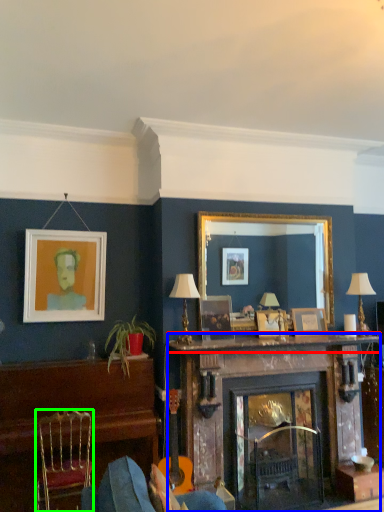
Question: Estimate the real-world distances between objects in this image. Which object is farther from mantle (highlighted by a red box), fireplace (highlighted by a blue box) or chair (highlighted by a green box)?

Choices:
 (A) fireplace
 (B) chair

Answer: (B)